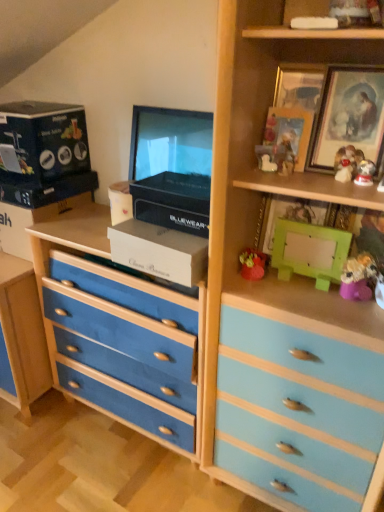
Measure the distance between wooden framed picture at upper right, the first picture frame positioned from the right, and camera.

3.70 feet.

Image resolution: width=384 pixels, height=512 pixels. Describe the element at coordinates (120, 333) in the screenshot. I see `blue fabric chest of drawers at center` at that location.

Locate an element on the screen. This screenshot has width=384, height=512. wooden picture frame at upper right, marked as the third picture frame in a right-to-left arrangement is located at coordinates (290, 131).

Locate an element on the screen. Image resolution: width=384 pixels, height=512 pixels. matte red vase at center-right, the third toy viewed from the top is located at coordinates (252, 264).

Describe the element at coordinates (30, 222) in the screenshot. I see `matte cardboard box at upper left, which is the 1th box from left to right` at that location.

I want to click on wooden framed picture at upper right, the first picture frame positioned from the right, so click(x=349, y=118).

Based on the photo, in terms of size, does matte red vase at center-right, the third toy viewed from the top, appear bigger or smaller than wooden picture frame at upper right, marked as the third picture frame in a right-to-left arrangement?

Considering their sizes, matte red vase at center-right, the third toy viewed from the top, takes up less space than wooden picture frame at upper right, marked as the third picture frame in a right-to-left arrangement.

From the picture: From the image's perspective, which one is positioned lower, matte red vase at center-right, which is counted as the fourth toy, starting from the right, or wooden picture frame at upper right, which appears as the 1th picture frame when viewed from the left?

matte red vase at center-right, which is counted as the fourth toy, starting from the right, is shown below in the image.

Does matte red vase at center-right, the third toy viewed from the top, have a greater height compared to wooden picture frame at upper right, marked as the third picture frame in a right-to-left arrangement?

In fact, matte red vase at center-right, the third toy viewed from the top, may be shorter than wooden picture frame at upper right, marked as the third picture frame in a right-to-left arrangement.

Is matte red vase at center-right, which is counted as the fourth toy, starting from the right, behind wooden picture frame at upper right, marked as the third picture frame in a right-to-left arrangement?

That is True.

From the image's perspective, which is above, wooden picture frame at upper right, marked as the third picture frame in a right-to-left arrangement, or blue fabric chest of drawers at center?

From the image's view, wooden picture frame at upper right, marked as the third picture frame in a right-to-left arrangement, is above.

From a real-world perspective, who is located higher, wooden picture frame at upper right, which appears as the 1th picture frame when viewed from the left, or blue fabric chest of drawers at center?

From a 3D spatial view, wooden picture frame at upper right, which appears as the 1th picture frame when viewed from the left, is above.

From the picture: Which object is positioned more to the left, wooden picture frame at upper right, which appears as the 1th picture frame when viewed from the left, or blue fabric chest of drawers at center?

From the viewer's perspective, blue fabric chest of drawers at center appears more on the left side.

Considering the positions of point (306, 125) and point (73, 324), is point (306, 125) closer or farther from the camera than point (73, 324)?

Clearly, point (306, 125) is closer to the camera than point (73, 324).

Does matte cardboard box at upper left, which is the fifth box in right-to-left order, have a lesser height compared to fuzzy yellow toy at right, the fourth toy from the left?

No, matte cardboard box at upper left, which is the fifth box in right-to-left order, is not shorter than fuzzy yellow toy at right, the fourth toy from the left.

From a real-world perspective, which toy is the 2nd one above the matte cardboard box at upper left, which is the fifth box in right-to-left order? Please provide its 2D coordinates.

[(359, 277)]

Is matte cardboard box at upper left, which is the 1th box from left to right, closer to the viewer compared to fuzzy yellow toy at right, the fourth toy from the left?

No, matte cardboard box at upper left, which is the 1th box from left to right, is behind fuzzy yellow toy at right, the fourth toy from the left.

How much distance is there between matte cardboard box at upper left, which is the 1th box from left to right, and fuzzy yellow toy at right, the fourth toy from the left?

1.26 meters.

From the image's perspective, would you say fuzzy yellow toy at right, positioned as the first toy in right-to-left order, is positioned over green matte box at upper right, which is counted as the first box, starting from the right?

No, from the image's perspective, fuzzy yellow toy at right, positioned as the first toy in right-to-left order, is not on top of green matte box at upper right, which is counted as the first box, starting from the right.

From the green matte box at upper right, which is counted as the fifth box, starting from the left, count 1st toys forward and point to it. Please provide its 2D coordinates.

[(359, 277)]

Which is in front, point (355, 285) or point (287, 239)?

The point (355, 285) is closer to the camera.

Is fuzzy yellow toy at right, placed as the fourth toy when sorted from top to bottom, in contact with green matte box at upper right, which is counted as the fifth box, starting from the left?

No, fuzzy yellow toy at right, placed as the fourth toy when sorted from top to bottom, is not touching green matte box at upper right, which is counted as the fifth box, starting from the left.

In the scene shown: Which is behind, matte red vase at center-right, which is counted as the fourth toy, starting from the right, or matte red figurine at upper right, the 2th toy in the top-to-bottom sequence?

matte red vase at center-right, which is counted as the fourth toy, starting from the right, is further from the camera.

Is matte red vase at center-right, which is counted as the fourth toy, starting from the right, oriented towards matte red figurine at upper right, the 2th toy in the top-to-bottom sequence?

No, matte red vase at center-right, which is counted as the fourth toy, starting from the right, is not aimed at matte red figurine at upper right, the 2th toy in the top-to-bottom sequence.

Considering the positions of objects matte red vase at center-right, the third toy viewed from the top, and matte red figurine at upper right, which is the third toy from bottom to top, in the image provided, who is more to the right, matte red vase at center-right, the third toy viewed from the top, or matte red figurine at upper right, which is the third toy from bottom to top,?

From the viewer's perspective, matte red figurine at upper right, which is the third toy from bottom to top, appears more on the right side.

Consider the image. Is matte red vase at center-right, which is counted as the fourth toy, starting from the right, located outside matte red figurine at upper right, the third toy from the left?

Yes, matte red vase at center-right, which is counted as the fourth toy, starting from the right, is outside of matte red figurine at upper right, the third toy from the left.

From a real-world perspective, is white cardboard box at center, the 3th box viewed from the left, physically below fuzzy yellow toy at right, the fourth toy from the left?

No.

How many degrees apart are the facing directions of white cardboard box at center, the 3th box viewed from the left, and fuzzy yellow toy at right, placed as the fourth toy when sorted from top to bottom?

0.946 degrees.

Which of these two, white cardboard box at center, the 3th box viewed from the left, or fuzzy yellow toy at right, placed as the fourth toy when sorted from top to bottom, is wider?

Wider between the two is white cardboard box at center, the 3th box viewed from the left.

Does point (151, 236) lie behind point (346, 294)?

That is True.

Is matte cardboard box at upper left, which is the 1th box from left to right, in front of wooden picture frame at upper right, which appears as the 1th picture frame when viewed from the left?

That is False.

Considering the relative sizes of matte cardboard box at upper left, which is the 1th box from left to right, and wooden picture frame at upper right, marked as the third picture frame in a right-to-left arrangement, in the image provided, is matte cardboard box at upper left, which is the 1th box from left to right, smaller than wooden picture frame at upper right, marked as the third picture frame in a right-to-left arrangement,?

Incorrect, matte cardboard box at upper left, which is the 1th box from left to right, is not smaller in size than wooden picture frame at upper right, marked as the third picture frame in a right-to-left arrangement.

Which is nearer, (27,248) or (269,141)?

Positioned in front is point (269,141).

Starting from the matte cardboard box at upper left, which is the 1th box from left to right, which picture frame is the 1st one to the right? Please provide its 2D coordinates.

[(290, 131)]

The width and height of the screenshot is (384, 512). Identify the location of toy behind the wooden picture frame at upper right, marked as the third picture frame in a right-to-left arrangement. (252, 264).

Where is `picture frame that is the 2nd one when counting forward from the blue fabric chest of drawers at center`? This screenshot has height=512, width=384. picture frame that is the 2nd one when counting forward from the blue fabric chest of drawers at center is located at coordinates (290, 131).

In the scene shown: Based on their spatial positions, is matte cardboard box at upper left, which is the 1th box from left to right, or blue fabric chest of drawers at center further from wooden framed picture at upper right, the 3th picture frame viewed from the left?

matte cardboard box at upper left, which is the 1th box from left to right, is further to wooden framed picture at upper right, the 3th picture frame viewed from the left.

Which object lies nearer to the anchor point wooden picture frame at upper right, marked as the third picture frame in a right-to-left arrangement, matte red figurine at upper right, which is counted as the 2th toy, starting from the right, or matte black box at upper left, the fourth box when ordered from right to left?

matte red figurine at upper right, which is counted as the 2th toy, starting from the right, lies closer to wooden picture frame at upper right, marked as the third picture frame in a right-to-left arrangement, than the other object.

When comparing their distances from wooden picture frame at upper right, which is the second picture frame in left-to-right order, does white cardboard box at center, the third box in the right-to-left sequence, or wooden picture frame at upper right, which appears as the 1th picture frame when viewed from the left, seem closer?

Based on the image, wooden picture frame at upper right, which appears as the 1th picture frame when viewed from the left, appears to be nearer to wooden picture frame at upper right, which is the second picture frame in left-to-right order.

Which object lies further to the anchor point matte cardboard box at upper left, which is the fifth box in right-to-left order, white cardboard box at center, the third box in the right-to-left sequence, or wooden picture frame at upper right, which is the second picture frame in left-to-right order?

wooden picture frame at upper right, which is the second picture frame in left-to-right order.

Which object lies further to the anchor point fuzzy yellow toy at right, placed as the fourth toy when sorted from top to bottom, matte cardboard box at upper left, which is the 1th box from left to right, or wooden picture frame at upper right, which is the second picture frame in left-to-right order?

The object further to fuzzy yellow toy at right, placed as the fourth toy when sorted from top to bottom, is matte cardboard box at upper left, which is the 1th box from left to right.

Based on their spatial positions, is black plastic box at center, marked as the 4th box in a left-to-right arrangement, or white glossy figurine at upper right, the 3th toy when ordered from right to left, further from matte red vase at center-right, which ranks as the 2th toy in bottom-to-top order?

Based on the image, white glossy figurine at upper right, the 3th toy when ordered from right to left, appears to be further to matte red vase at center-right, which ranks as the 2th toy in bottom-to-top order.

From the image, which object appears to be nearer to matte red figurine at upper right, which is the third toy from bottom to top, white glossy figurine at upper right, marked as the 4th toy in a bottom-to-top arrangement, or matte black box at upper left, arranged as the second box when viewed from the left?

white glossy figurine at upper right, marked as the 4th toy in a bottom-to-top arrangement.

Estimate the real-world distances between objects in this image. Which object is further from wooden picture frame at upper right, marked as the third picture frame in a right-to-left arrangement, white cardboard box at center, the third box in the right-to-left sequence, or green matte box at upper right, which is counted as the fifth box, starting from the left?

white cardboard box at center, the third box in the right-to-left sequence, is further to wooden picture frame at upper right, marked as the third picture frame in a right-to-left arrangement.

Identify the location of the chest of drawers located between matte black box at upper left, arranged as the second box when viewed from the left, and wooden framed picture at upper right, the first picture frame positioned from the right, in the left-right direction. (120, 333).

Where is `chest of drawers between matte cardboard box at upper left, which is the fifth box in right-to-left order, and matte red vase at center-right, positioned as the first toy in left-to-right order`? Image resolution: width=384 pixels, height=512 pixels. chest of drawers between matte cardboard box at upper left, which is the fifth box in right-to-left order, and matte red vase at center-right, positioned as the first toy in left-to-right order is located at coordinates (120, 333).

At what (x,y) coordinates should I click in order to perform the action: click on box between matte cardboard box at upper left, which is the fifth box in right-to-left order, and white cardboard box at center, the 3th box viewed from the left, in the horizontal direction. Please return your answer as a coordinate pair (x, y). The width and height of the screenshot is (384, 512). Looking at the image, I should click on (42, 141).

The width and height of the screenshot is (384, 512). Identify the location of toy located between matte cardboard box at upper left, which is the fifth box in right-to-left order, and wooden picture frame at upper right, marked as the third picture frame in a right-to-left arrangement, in the left-right direction. (252, 264).